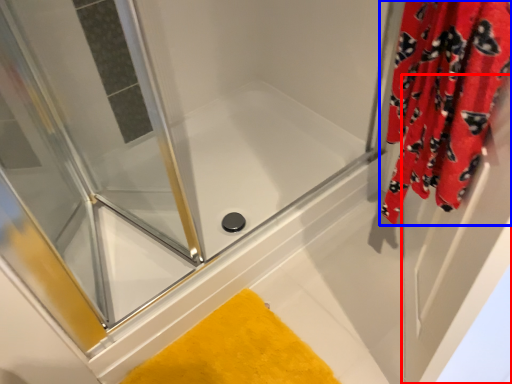
Question: Among these objects, which one is farthest to the camera, screen door (highlighted by a red box) or curtain (highlighted by a blue box)?

Choices:
 (A) screen door
 (B) curtain

Answer: (A)